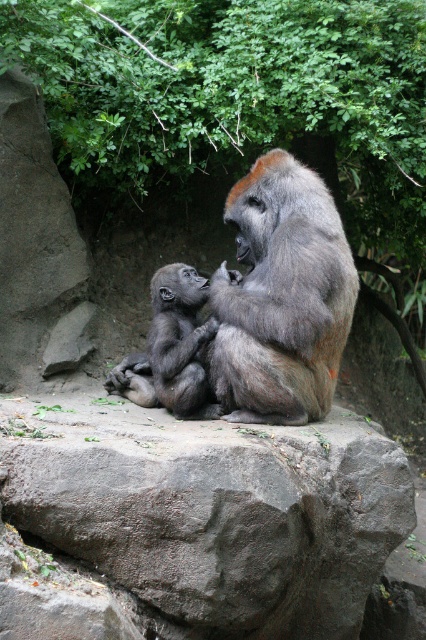
Question: Estimate the real-world distances between objects in this image. Which object is closer to the green leafy tree at upper center?

Choices:
 (A) gray furry gorilla at center
 (B) gray furry baby gorilla at left

Answer: (A)

Question: Is gray furry gorilla at center to the right of gray furry baby gorilla at left from the viewer's perspective?

Choices:
 (A) no
 (B) yes

Answer: (B)

Question: Is green leafy tree at upper center bigger than gray rough boulder at center?

Choices:
 (A) no
 (B) yes

Answer: (B)

Question: Which object is farther from the camera taking this photo?

Choices:
 (A) gray furry gorilla at center
 (B) gray rough boulder at center
 (C) green leafy tree at upper center

Answer: (C)

Question: Which of the following is the farthest from the observer?

Choices:
 (A) (276, 172)
 (B) (63, 516)
 (C) (169, 312)
 (D) (78, 17)

Answer: (C)

Question: Is gray rough boulder at center to the right of gray furry baby gorilla at left from the viewer's perspective?

Choices:
 (A) no
 (B) yes

Answer: (B)